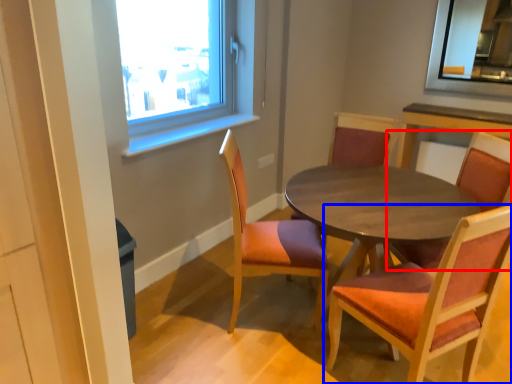
Question: Which point is further to the camera, chair (highlighted by a red box) or chair (highlighted by a blue box)?

Choices:
 (A) chair
 (B) chair

Answer: (A)